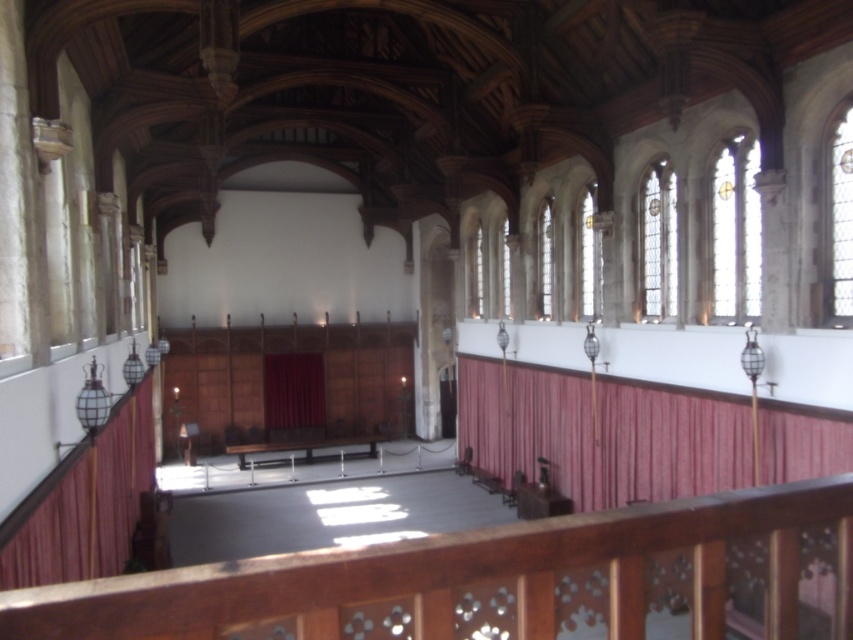
Does velvet-like red curtain at center have a greater height compared to velvet deep red curtain at center?

Indeed, velvet-like red curtain at center has a greater height compared to velvet deep red curtain at center.

Between point (585, 406) and point (300, 417), which one is positioned in front?

Positioned in front is point (585, 406).

Image resolution: width=853 pixels, height=640 pixels. I want to click on velvet-like red curtain at center, so click(x=602, y=435).

Consider the image. Who is higher up, matte red curtain at left or velvet deep red curtain at center?

velvet deep red curtain at center

Which is more to the right, matte red curtain at left or velvet deep red curtain at center?

velvet deep red curtain at center

Which is in front, point (143, 428) or point (286, 374)?

Positioned in front is point (143, 428).

Find the location of a particular element. matte red curtain at left is located at coordinates (50, 525).

Is point (463, 417) positioned before point (112, 481)?

No, (463, 417) is further to viewer.

Between point (703, 410) and point (79, 504), which one is positioned behind?

Point (703, 410)

Between point (821, 467) and point (109, 476), which one is positioned in front?

Point (821, 467) is in front.

The width and height of the screenshot is (853, 640). In order to click on velvet-like red curtain at center in this screenshot , I will do `click(602, 435)`.